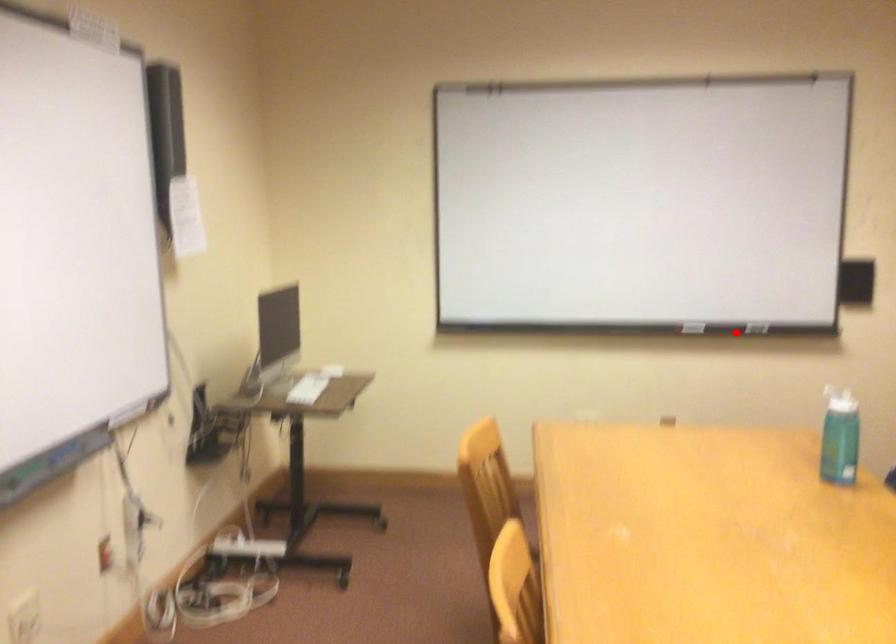
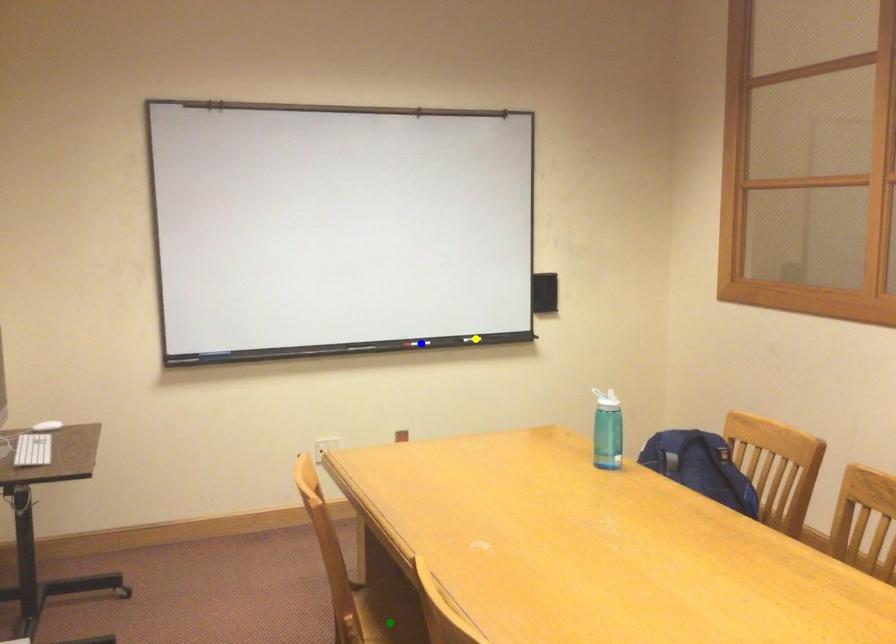
Question: I am providing you with two images of the same scene from different viewpoints. A red point is marked on the first image. You are given multiple points on the second image. Which spot in image 2 lines up with the point in image 1?

Choices:
 (A) yellow point
 (B) blue point
 (C) green point

Answer: (B)